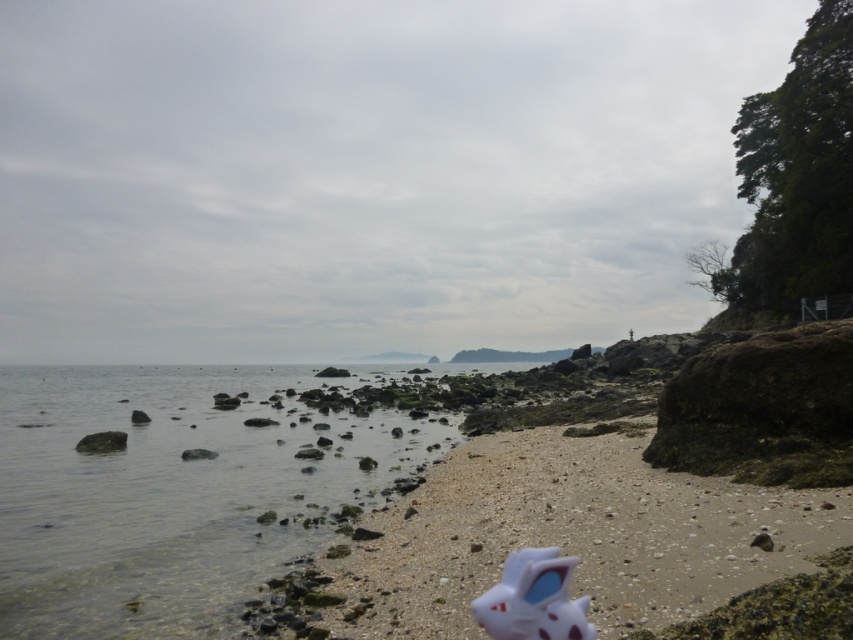
Who is taller, clear water at beach left or white matte toy at lower center?

clear water at beach left is taller.

Who is more distant from viewer, (144, 481) or (512, 600)?

The point (144, 481) is more distant.

Does point (112, 595) come behind point (517, 593)?

That is True.

The height and width of the screenshot is (640, 853). In order to click on clear water at beach left in this screenshot , I will do `click(171, 492)`.